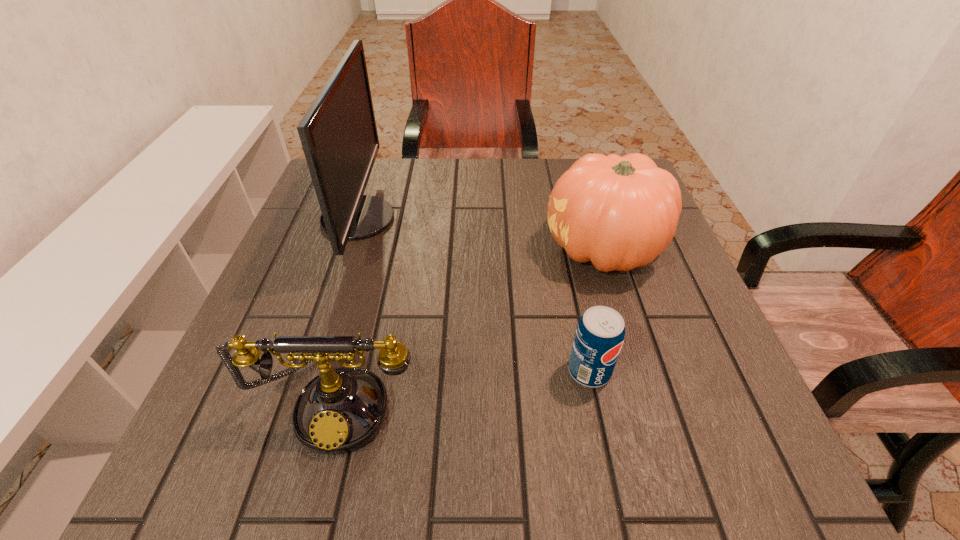
The height and width of the screenshot is (540, 960). I want to click on the tallest object, so click(x=338, y=133).

The width and height of the screenshot is (960, 540). What are the coordinates of `pumpkin` in the screenshot? It's located at (620, 213).

Where is `telephone`? The image size is (960, 540). telephone is located at coordinates (341, 410).

Where is `pop`? This screenshot has width=960, height=540. pop is located at coordinates (599, 336).

Where is `vacant point located on the screen side of the tallest object`? vacant point located on the screen side of the tallest object is located at coordinates (444, 219).

Locate an element on the screen. free space located 0.230m on the carved face of the pumpkin is located at coordinates (440, 249).

What are the coordinates of `free space located 0.060m on the carved face of the pumpkin` in the screenshot? It's located at (516, 249).

Identify the location of free space located on the carved face of the pumpkin. This screenshot has height=540, width=960. (395, 249).

The height and width of the screenshot is (540, 960). What are the coordinates of `vacant space located 0.280m on the left of the pop` in the screenshot? It's located at (402, 371).

Where is `object at the far edge`? The height and width of the screenshot is (540, 960). object at the far edge is located at coordinates (338, 133).